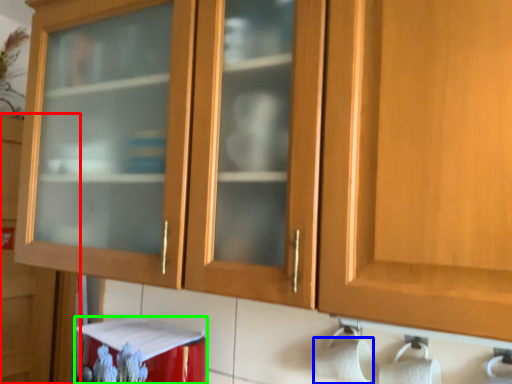
Question: Which is nearer to the cupboard (highlighted by a red box)? toilet paper (highlighted by a blue box) or appliance (highlighted by a green box).

Choices:
 (A) toilet paper
 (B) appliance

Answer: (B)